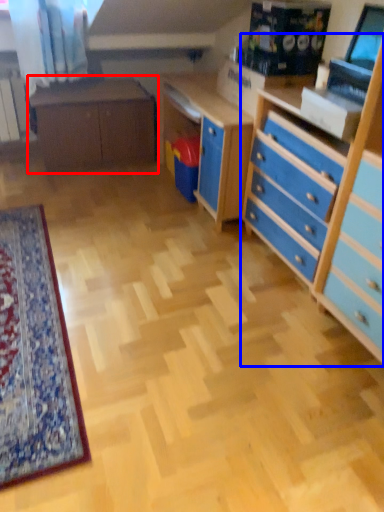
Question: Which point is closer to the camera, table (highlighted by a red box) or chest of drawers (highlighted by a blue box)?

Choices:
 (A) table
 (B) chest of drawers

Answer: (B)